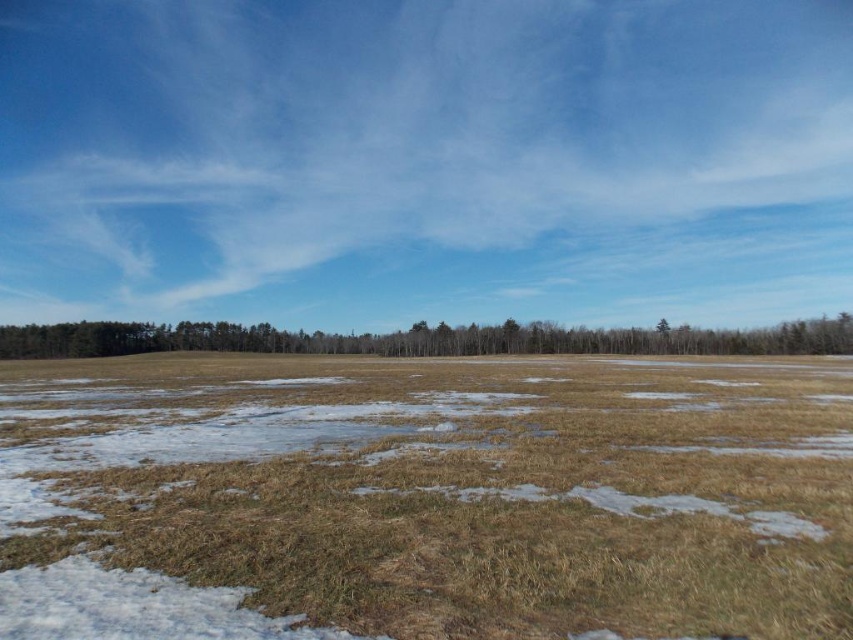
Question: Is brown dry grass at center wider than brown matte trees at center?

Choices:
 (A) yes
 (B) no

Answer: (B)

Question: Which point is farther to the camera?

Choices:
 (A) brown dry grass at center
 (B) brown matte trees at center

Answer: (B)

Question: Is brown dry grass at center closer to camera compared to brown matte trees at center?

Choices:
 (A) no
 (B) yes

Answer: (B)

Question: Is brown dry grass at center further to the viewer compared to brown matte trees at center?

Choices:
 (A) no
 (B) yes

Answer: (A)

Question: Which object appears closest to the camera in this image?

Choices:
 (A) brown dry grass at center
 (B) brown matte trees at center

Answer: (A)